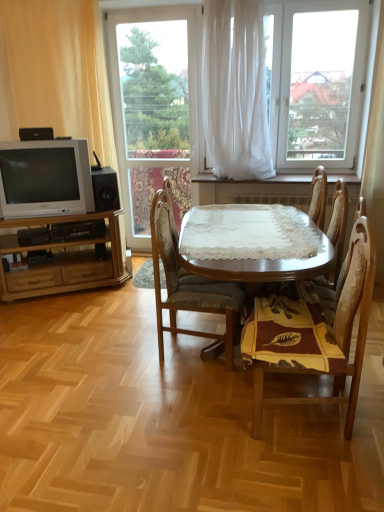
Question: Can you confirm if black matte speaker at lower left, which is the second loudspeaker in left-to-right order, is shorter than wooden chair at center, which is the 1th chair from right to left?

Choices:
 (A) yes
 (B) no

Answer: (A)

Question: Is black matte speaker at lower left, which is the 2th loudspeaker in top-to-bottom order, bigger than wooden chair at center, positioned as the third chair in left-to-right order?

Choices:
 (A) no
 (B) yes

Answer: (A)

Question: Would you say black matte speaker at lower left, placed as the second loudspeaker when sorted from front to back, is outside wooden chair at center, positioned as the third chair in left-to-right order?

Choices:
 (A) yes
 (B) no

Answer: (A)

Question: Is black matte speaker at lower left, which is the 2th loudspeaker in top-to-bottom order, positioned with its back to wooden chair at center, which is the 1th chair from right to left?

Choices:
 (A) no
 (B) yes

Answer: (A)

Question: Is black matte speaker at lower left, which is the 2th loudspeaker in top-to-bottom order, facing towards wooden chair at center, positioned as the third chair in left-to-right order?

Choices:
 (A) yes
 (B) no

Answer: (B)

Question: From the image's perspective, is black matte speaker at lower left, which ranks as the first loudspeaker in bottom-to-top order, above or below white sheer curtain at center, the 1th curtain in the right-to-left sequence?

Choices:
 (A) above
 (B) below

Answer: (B)

Question: Considering the positions of black matte speaker at lower left, which is the 2th loudspeaker in top-to-bottom order, and white sheer curtain at center, the 2th curtain positioned from the left, in the image, is black matte speaker at lower left, which is the 2th loudspeaker in top-to-bottom order, taller or shorter than white sheer curtain at center, the 2th curtain positioned from the left,?

Choices:
 (A) tall
 (B) short

Answer: (B)

Question: Is black matte speaker at lower left, which appears as the first loudspeaker when viewed from the right, situated inside white sheer curtain at center, the 2th curtain positioned from the left, or outside?

Choices:
 (A) inside
 (B) outside

Answer: (B)

Question: Considering the positions of point (102, 173) and point (243, 142), is point (102, 173) closer or farther from the camera than point (243, 142)?

Choices:
 (A) farther
 (B) closer

Answer: (B)

Question: In terms of height, does white sheer curtain at upper center, placed as the second window when sorted from left to right, look taller or shorter compared to wooden table at center?

Choices:
 (A) short
 (B) tall

Answer: (B)

Question: Looking at their shapes, would you say white sheer curtain at upper center, which appears as the first window when viewed from the right, is wider or thinner than wooden table at center?

Choices:
 (A) wide
 (B) thin

Answer: (B)

Question: From the image's perspective, relative to wooden table at center, is white sheer curtain at upper center, placed as the second window when sorted from left to right, above or below?

Choices:
 (A) below
 (B) above

Answer: (B)

Question: From a real-world perspective, is white sheer curtain at upper center, which appears as the first window when viewed from the right, above or below wooden table at center?

Choices:
 (A) below
 (B) above

Answer: (B)

Question: Does point (210, 74) appear closer or farther from the camera than point (11, 185)?

Choices:
 (A) farther
 (B) closer

Answer: (A)

Question: Would you say white sheer curtain at center, the 1th curtain in the right-to-left sequence, is inside or outside matte silver television at left?

Choices:
 (A) outside
 (B) inside

Answer: (A)